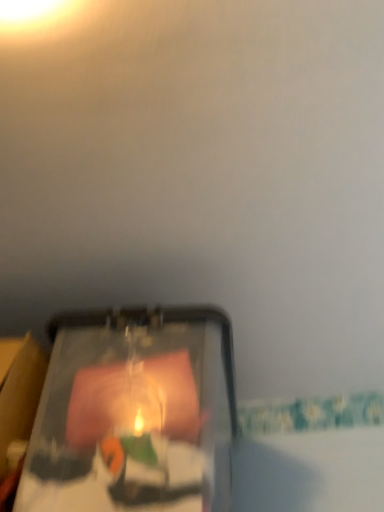
The width and height of the screenshot is (384, 512). What do you see at coordinates (134, 413) in the screenshot?
I see `matte black tablet at center` at bounding box center [134, 413].

Image resolution: width=384 pixels, height=512 pixels. Identify the location of matte black tablet at center. (134, 413).

This screenshot has width=384, height=512. What are the coordinates of `matte black tablet at center` in the screenshot? It's located at (134, 413).